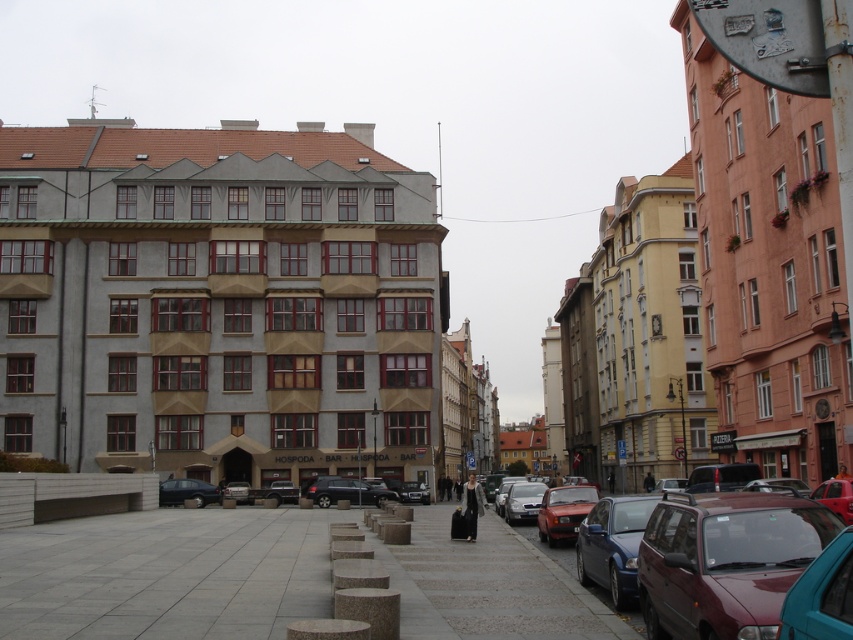
Question: Which is farther from the gray concrete pavement at lower center?

Choices:
 (A) maroon metallic car at right
 (B) matte black car at lower left
 (C) metallic silver suv at center

Answer: (C)

Question: Observing the image, what is the correct spatial positioning of gray concrete pavement at lower center in reference to matte black car at lower left?

Choices:
 (A) above
 (B) below

Answer: (A)

Question: Which object appears closest to the camera in this image?

Choices:
 (A) gray concrete pavement at lower center
 (B) metallic silver suv at center
 (C) matte black car at lower left
 (D) maroon metallic car at right

Answer: (D)

Question: Which point is farther from the camera taking this photo?

Choices:
 (A) (339, 480)
 (B) (689, 602)
 (C) (198, 497)

Answer: (A)

Question: Does gray concrete pavement at lower center have a smaller size compared to metallic silver suv at center?

Choices:
 (A) yes
 (B) no

Answer: (B)

Question: Is maroon metallic car at right below metallic silver suv at center?

Choices:
 (A) yes
 (B) no

Answer: (B)